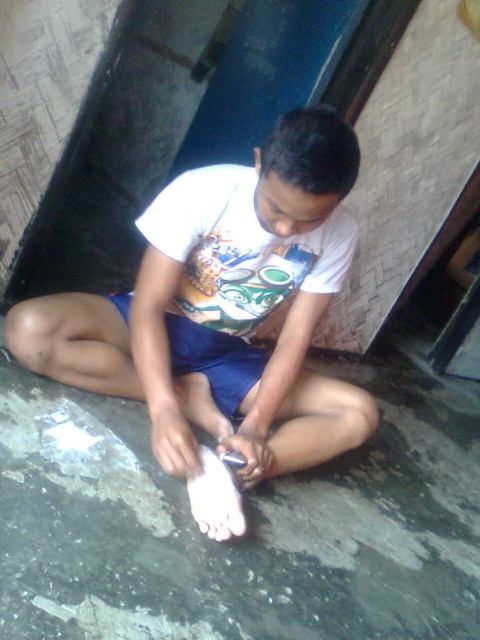
You are trying to determine if the shiny gray cement at lower center can fully cover the white matte shirt at center if placed over it. Based on their sizes, is this possible?

The shiny gray cement at lower center might be wider than white matte shirt at center, so it could potentially cover it depending on the exact dimensions.